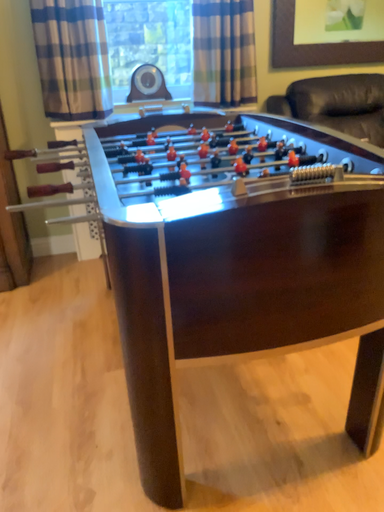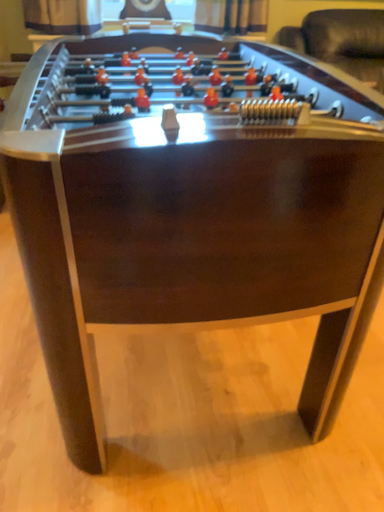
Question: Which way did the camera rotate in the video?

Choices:
 (A) rotated upward
 (B) rotated downward

Answer: (B)